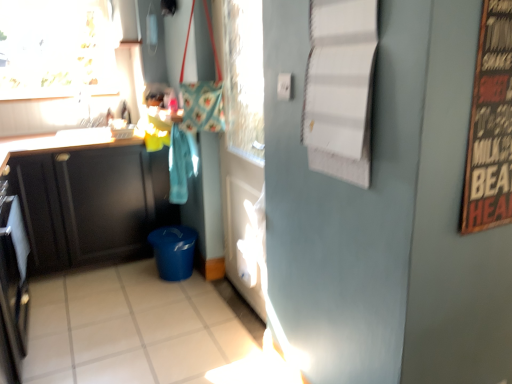
Image resolution: width=512 pixels, height=384 pixels. I want to click on vacant area that is situated to the right of black stainless steel oven at left, so click(x=87, y=333).